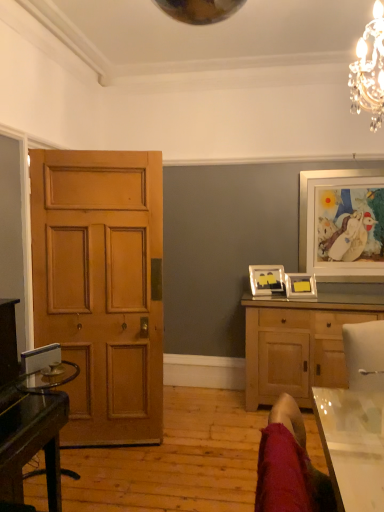
The width and height of the screenshot is (384, 512). In order to click on empty space that is ontop of white glossy picture frame at upper right, the third picture frame viewed from the left in this screenshot , I will do `click(339, 170)`.